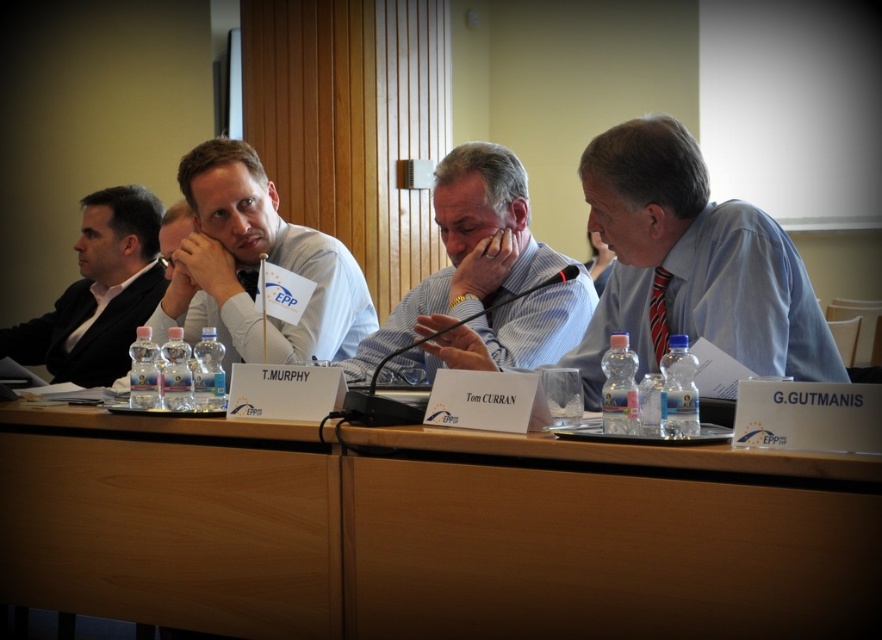
Question: Does white shirt at center appear on the right side of black suit at left?

Choices:
 (A) no
 (B) yes

Answer: (B)

Question: Can you confirm if brown wood table at center is bigger than white shirt at center?

Choices:
 (A) no
 (B) yes

Answer: (B)

Question: From the image, what is the correct spatial relationship of brown wood table at center in relation to white shirt at center?

Choices:
 (A) above
 (B) below

Answer: (B)

Question: Which of the following is the closest to the observer?

Choices:
 (A) click(x=374, y=358)
 (B) click(x=15, y=604)
 (C) click(x=102, y=384)

Answer: (B)

Question: Which object is farther from the camera taking this photo?

Choices:
 (A) blue striped shirt at center
 (B) brown wood table at center

Answer: (A)

Question: Among these points, which one is farthest from the camera?

Choices:
 (A) (244, 177)
 (B) (880, 480)
 (C) (483, 289)
 (D) (92, 280)

Answer: (D)